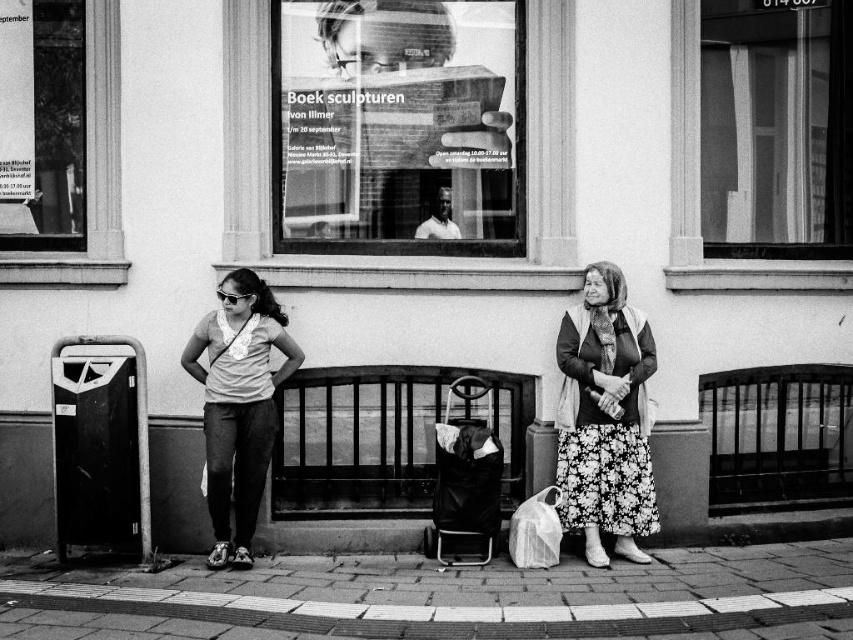
Is brick pavement at lower center taller than floral skirt at center?

No, brick pavement at lower center is not taller than floral skirt at center.

Looking at this image, which of these two, brick pavement at lower center or floral skirt at center, stands taller?

floral skirt at center

Which is behind, point (254, 621) or point (593, 282)?

Positioned behind is point (593, 282).

Where is `brick pavement at lower center`? brick pavement at lower center is located at coordinates (442, 596).

Is point (766, 611) positioned before point (512, 538)?

Yes.

Can you confirm if brick pavement at lower center is thinner than translucent plastic bag at lower center?

Incorrect, brick pavement at lower center's width is not less than translucent plastic bag at lower center's.

Is point (132, 609) behind point (543, 516)?

No, (132, 609) is in front of (543, 516).

Image resolution: width=853 pixels, height=640 pixels. What are the coordinates of `brick pavement at lower center` in the screenshot? It's located at (442, 596).

Is brick pavement at lower center further to the viewer compared to matte gray shirt at center?

No, brick pavement at lower center is in front of matte gray shirt at center.

From the picture: Who is positioned more to the right, brick pavement at lower center or matte gray shirt at center?

From the viewer's perspective, matte gray shirt at center appears more on the right side.

The image size is (853, 640). Identify the location of brick pavement at lower center. [x=442, y=596].